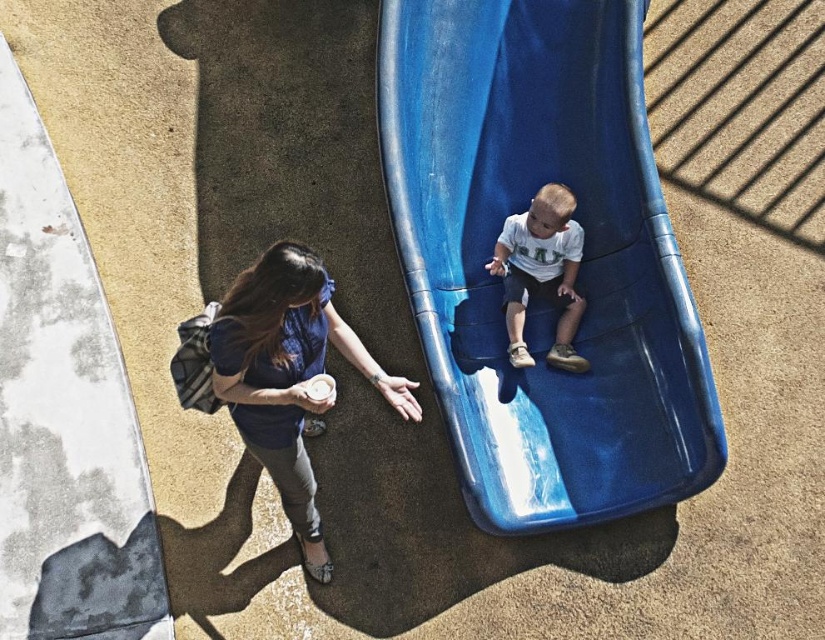
Is point (637, 138) closer to viewer compared to point (512, 342)?

No, it is not.

The image size is (825, 640). What do you see at coordinates (580, 268) in the screenshot?
I see `blue plastic slide at center` at bounding box center [580, 268].

Where is `blue plastic slide at center`? The width and height of the screenshot is (825, 640). blue plastic slide at center is located at coordinates (580, 268).

Which is behind, point (257, 385) or point (521, 349)?

The point (521, 349) is behind.

Identify the location of blue fabric shirt at lower left. click(x=288, y=376).

Identify the location of blue fabric shirt at lower left. This screenshot has width=825, height=640. (288, 376).

Between blue plastic slide at center and blue fabric shirt at lower left, which one is positioned lower?

Positioned lower is blue fabric shirt at lower left.

Can you confirm if blue plastic slide at center is positioned above blue fabric shirt at lower left?

Yes, blue plastic slide at center is above blue fabric shirt at lower left.

Image resolution: width=825 pixels, height=640 pixels. What do you see at coordinates (580, 268) in the screenshot?
I see `blue plastic slide at center` at bounding box center [580, 268].

This screenshot has height=640, width=825. Identify the location of blue plastic slide at center. (580, 268).